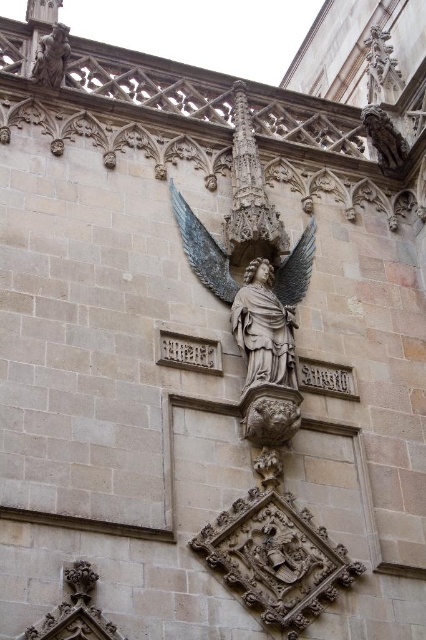
Describe the element at coordinates (203, 250) in the screenshot. I see `satin gold wings at center` at that location.

Consider the image. Does satin gold wings at center appear on the right side of matte stone angel at upper left?

Correct, you'll find satin gold wings at center to the right of matte stone angel at upper left.

Locate an element on the screen. The width and height of the screenshot is (426, 640). satin gold wings at center is located at coordinates (203, 250).

Where is `satin gold wings at center`? The height and width of the screenshot is (640, 426). satin gold wings at center is located at coordinates (203, 250).

Does polished stone angel at center appear under satin gold wings at center?

Indeed, polished stone angel at center is positioned under satin gold wings at center.

Who is more distant from viewer, (x=249, y=308) or (x=307, y=273)?

Positioned behind is point (x=307, y=273).

The width and height of the screenshot is (426, 640). What are the coordinates of `polished stone angel at center` in the screenshot? It's located at (264, 328).

Is polished stone angel at center smaller than polished bronze wing at center?

Incorrect, polished stone angel at center is not smaller in size than polished bronze wing at center.

Does polished stone angel at center appear under polished bronze wing at center?

Indeed, polished stone angel at center is positioned under polished bronze wing at center.

This screenshot has width=426, height=640. Describe the element at coordinates (264, 328) in the screenshot. I see `polished stone angel at center` at that location.

You are a GUI agent. You are given a task and a screenshot of the screen. Output one action in this format:
    pyautogui.click(x=<x>, y=<y>)
    Task: Click on the polished stone angel at center
    
    Given the screenshot: What is the action you would take?
    pyautogui.click(x=264, y=328)